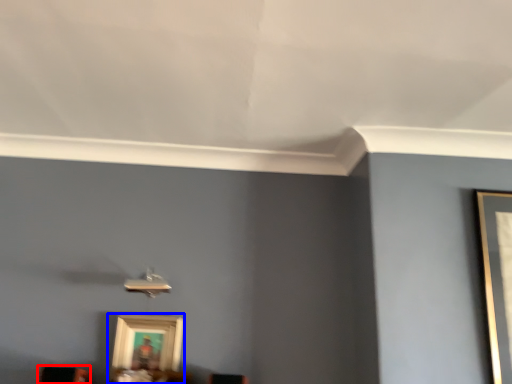
Question: Among these objects, which one is farthest to the camera, furniture (highlighted by a red box) or picture frame (highlighted by a blue box)?

Choices:
 (A) furniture
 (B) picture frame

Answer: (B)